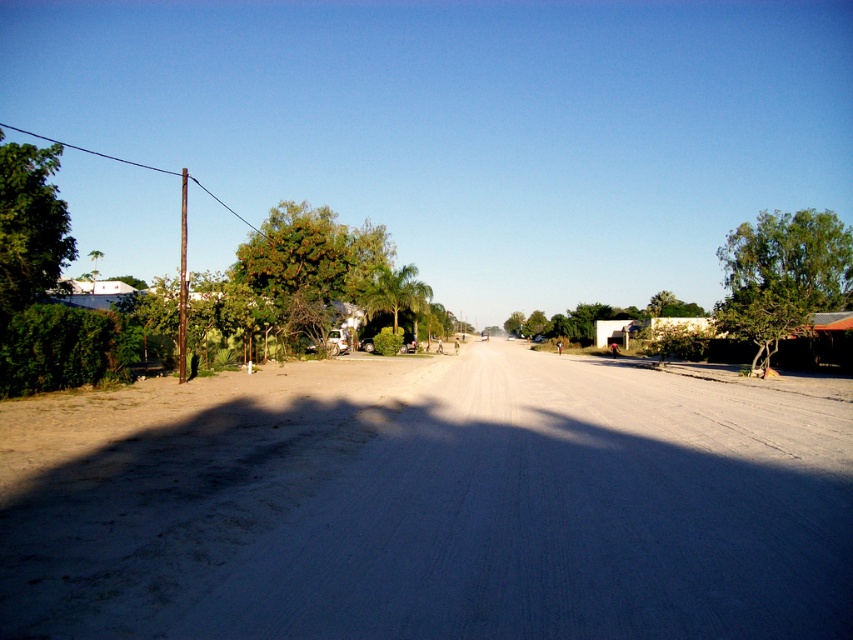
Question: Which point is closer to the camera?

Choices:
 (A) (553, 442)
 (B) (724, 241)
 (C) (0, 285)

Answer: (A)

Question: Considering the relative positions of gray gravel road at center and green leafy tree at right in the image provided, where is gray gravel road at center located with respect to green leafy tree at right?

Choices:
 (A) above
 (B) below

Answer: (B)

Question: Which of these objects is positioned farthest from the green leafy tree at left?

Choices:
 (A) gray gravel road at center
 (B) green leafy tree at right

Answer: (B)

Question: From the image, what is the correct spatial relationship of gray gravel road at center in relation to green leafy tree at right?

Choices:
 (A) above
 (B) below

Answer: (B)

Question: Among these points, which one is nearest to the camera?

Choices:
 (A) (312, 432)
 (B) (42, 161)
 (C) (744, 296)

Answer: (A)

Question: Is green leafy tree at right above green leafy tree at left?

Choices:
 (A) yes
 (B) no

Answer: (A)